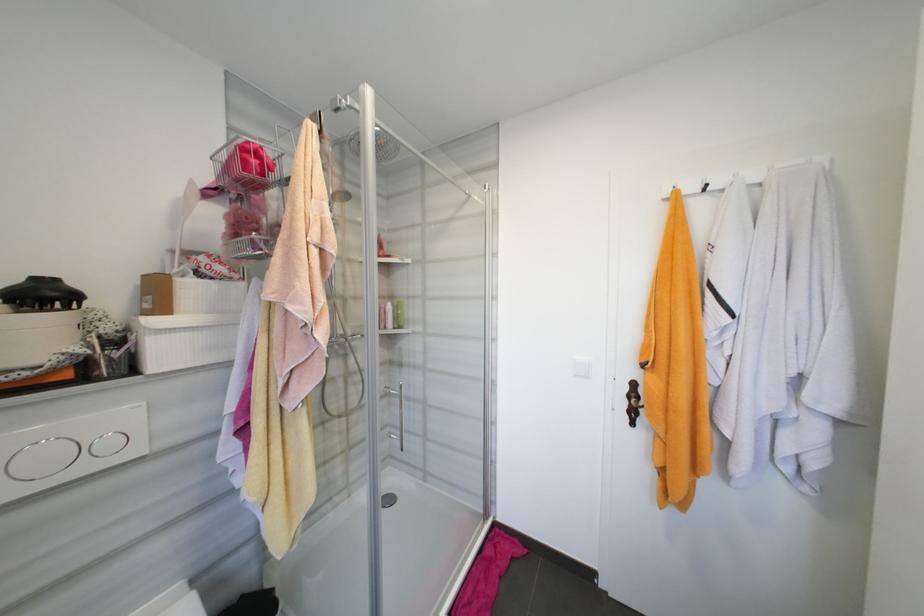
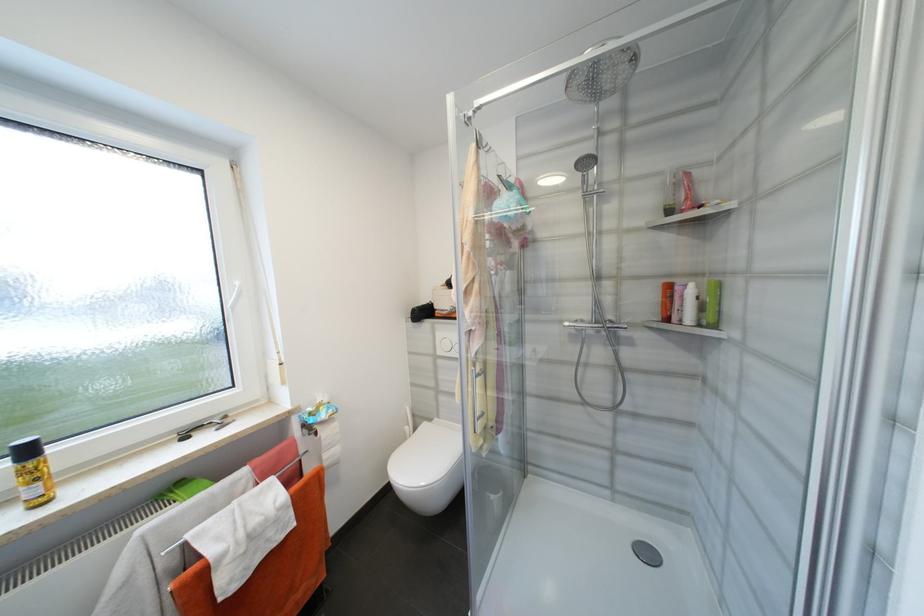
Where in the second image is the point corresponding to [391,312] from the first image?

(687, 297)